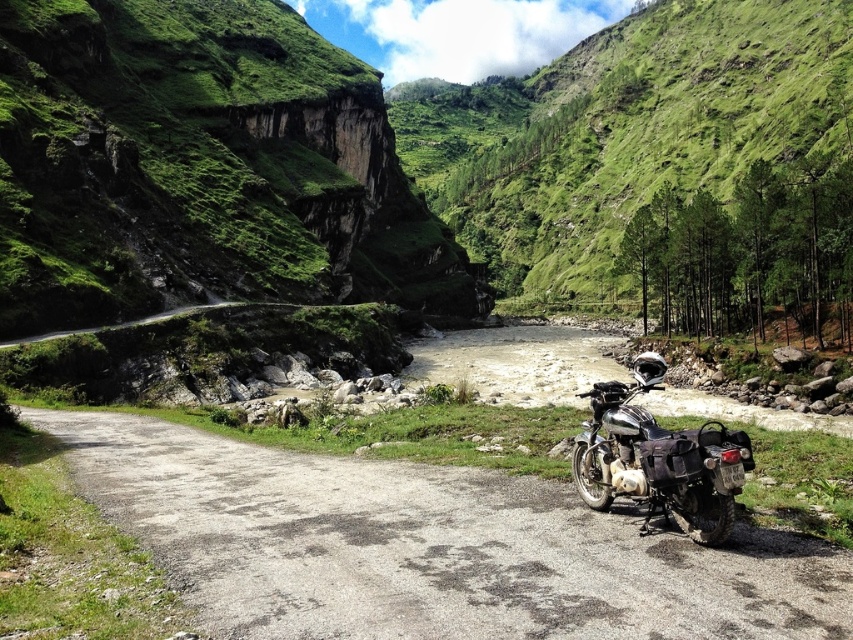
You are standing at point [720,506] and want to walk to point [432,112]. Which direction should you face to move towards your destination?

You should face towards the direction opposite of point [720,506] because point [432,112] is behind it.

You are a traveler planning to drive your shiny chrome motorcycle at center along the smooth asphalt road at center. Considering the road size, will there be enough space for your motorcycle to pass safely?

The smooth asphalt road at center has a smaller size compared to shiny chrome motorcycle at center. This means the road may not be wide enough to accommodate the motorcycle safely, so it might be risky to proceed.

Looking at this image, you are a photographer planning to capture a wide shot of the green grassy hillside at center and the shiny chrome motorcycle at center. Given that the motorcycle is smaller in the frame, where should you position yourself to ensure both subjects are adequately framed?

To ensure both the green grassy hillside at center and the shiny chrome motorcycle at center are adequately framed, position yourself farther away from the scene. This will allow the motorcycle to appear relatively larger in the frame while still capturing the vastness of the hillside.